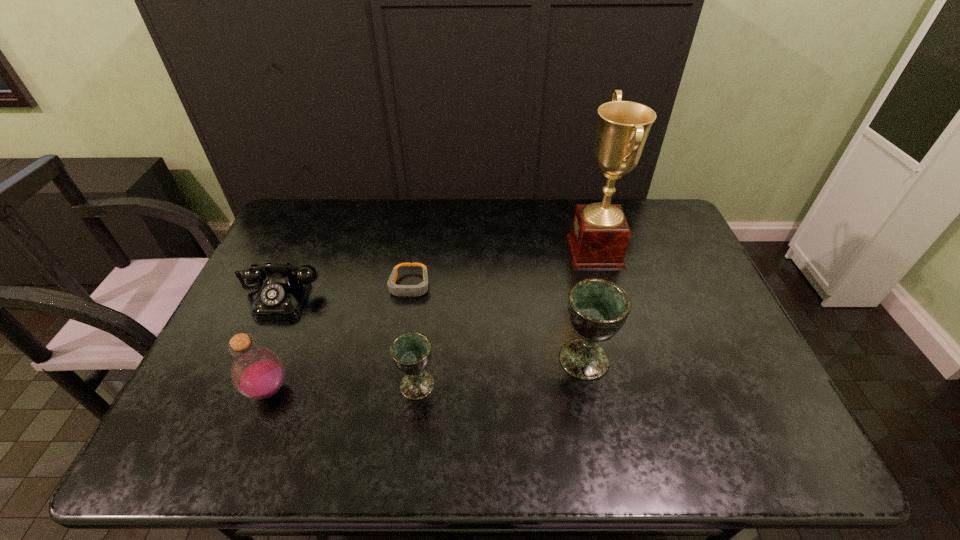
Locate an element on the screen. The width and height of the screenshot is (960, 540). the shorter chalice is located at coordinates (411, 352).

At what (x,y) coordinates should I click in order to perform the action: click on the left chalice. Please return your answer as a coordinate pair (x, y). The image size is (960, 540). Looking at the image, I should click on (411, 352).

This screenshot has height=540, width=960. I want to click on the right chalice, so click(x=597, y=308).

Locate an element on the screen. the tallest object is located at coordinates (599, 237).

In order to click on the second shortest object in this screenshot , I will do `click(281, 297)`.

Image resolution: width=960 pixels, height=540 pixels. Find the location of `the shortest object`. the shortest object is located at coordinates (397, 290).

Find the location of a particular element. The image size is (960, 540). the third tallest object is located at coordinates (257, 373).

This screenshot has height=540, width=960. Find the location of `free space located on the left of the shorter chalice`. free space located on the left of the shorter chalice is located at coordinates (337, 385).

Where is `blank space located 0.240m on the back of the taller chalice`? The width and height of the screenshot is (960, 540). blank space located 0.240m on the back of the taller chalice is located at coordinates (567, 276).

You are a GUI agent. You are given a task and a screenshot of the screen. Output one action in this format:
    pyautogui.click(x=<x>, y=<y>)
    Task: Click on the vacant space situated on the plaque of the tallest object
    
    Given the screenshot: What is the action you would take?
    pyautogui.click(x=549, y=252)